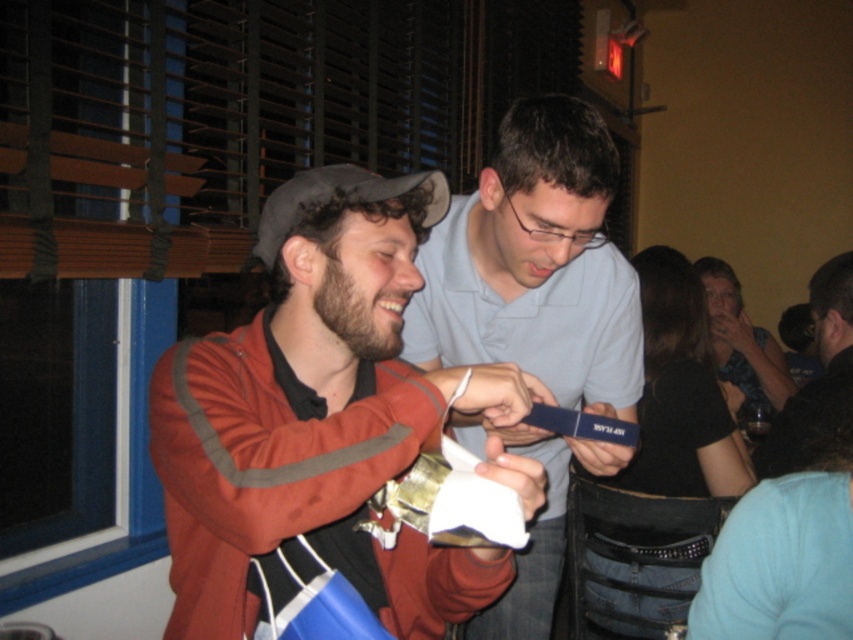
Question: Which point appears closest to the camera in this image?

Choices:
 (A) (x=784, y=451)
 (B) (x=296, y=317)

Answer: (B)

Question: Is matte blue shirt at center wider than matte black phone at right?

Choices:
 (A) yes
 (B) no

Answer: (A)

Question: Observing the image, what is the correct spatial positioning of matte brown cap at upper left in reference to dark blue shirt at center?

Choices:
 (A) below
 (B) above

Answer: (B)

Question: Does matte brown cap at upper left appear on the left side of dark blue shirt at center?

Choices:
 (A) no
 (B) yes

Answer: (B)

Question: Which of the following is the farthest from the observer?

Choices:
 (A) dark blue shirt at center
 (B) matte black phone at right
 (C) matte blue shirt at center

Answer: (B)

Question: Among these points, which one is farthest from the camera?

Choices:
 (A) (357, 301)
 (B) (840, 387)
 (C) (515, 432)

Answer: (B)